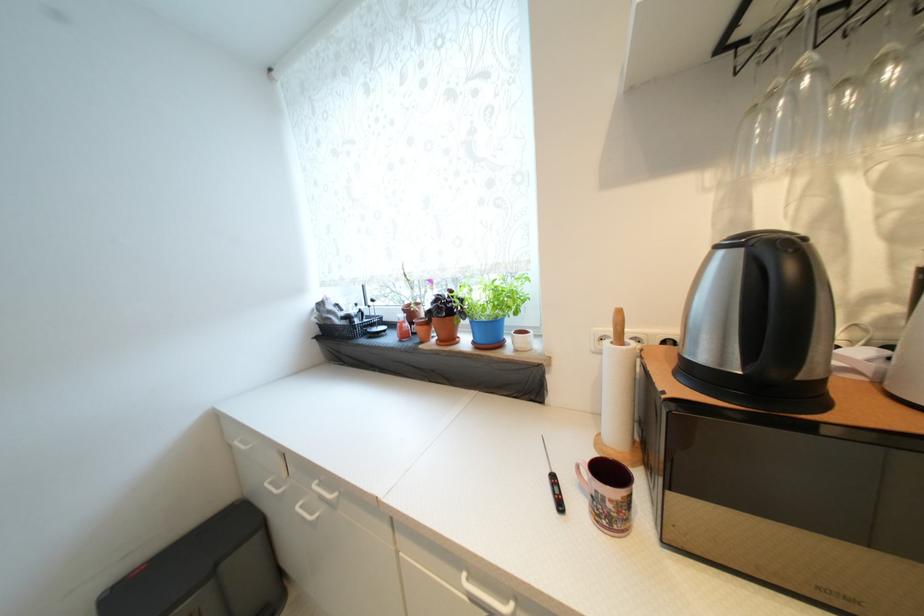
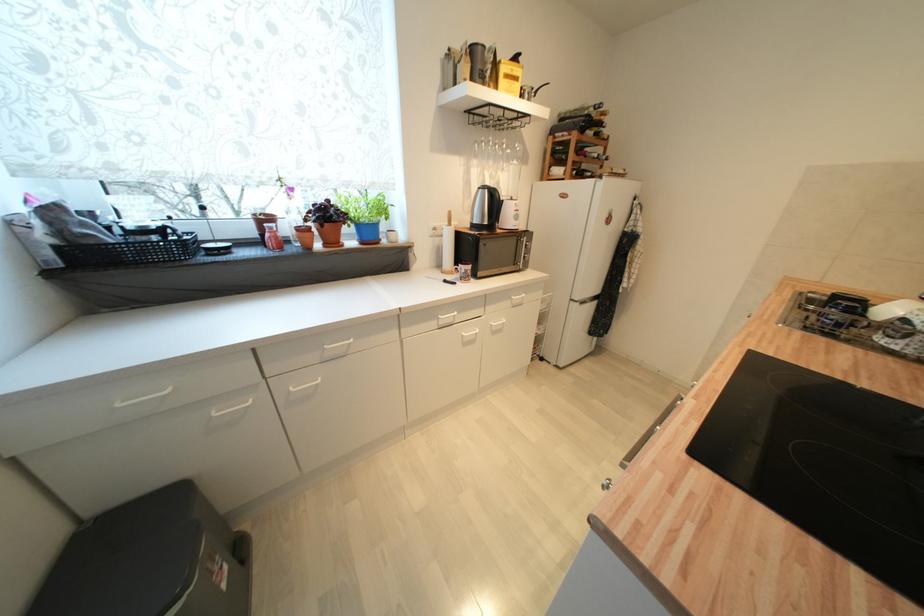
Find the pixel in the second image that matches point 445,342 in the first image.

(331, 246)